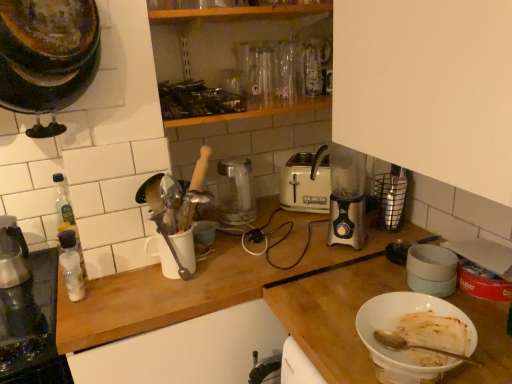
Where is `free space above wooden at center, the second countertop when ordered from front to back (from a real-world perspective)`? The image size is (512, 384). free space above wooden at center, the second countertop when ordered from front to back (from a real-world perspective) is located at coordinates (221, 248).